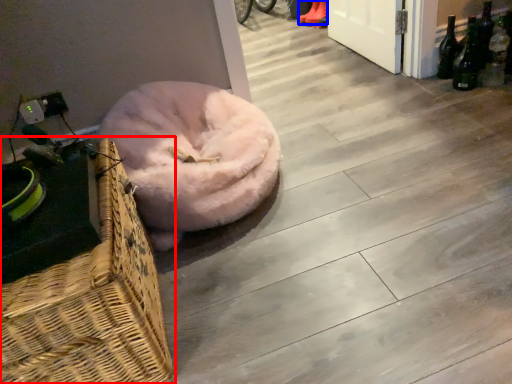
Question: Which point is closer to the camera, picnic basket (highlighted by a red box) or footwear (highlighted by a blue box)?

Choices:
 (A) picnic basket
 (B) footwear

Answer: (A)